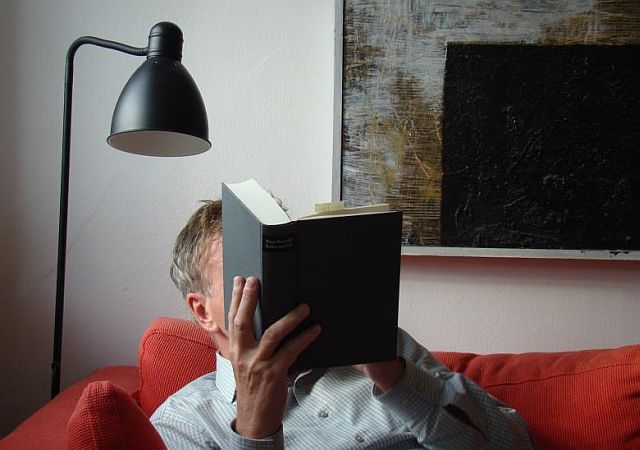
I want to click on book, so click(x=281, y=280).